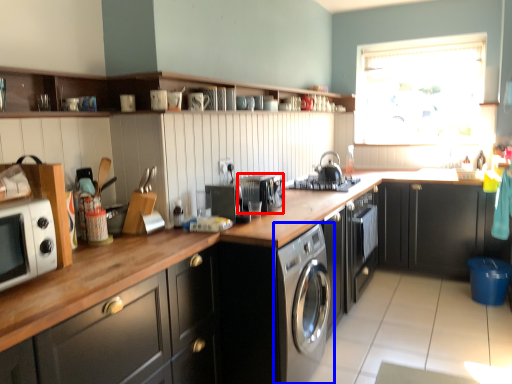
Question: Which point is closer to the camera, appliance (highlighted by a red box) or washing machine (highlighted by a blue box)?

Choices:
 (A) appliance
 (B) washing machine

Answer: (B)